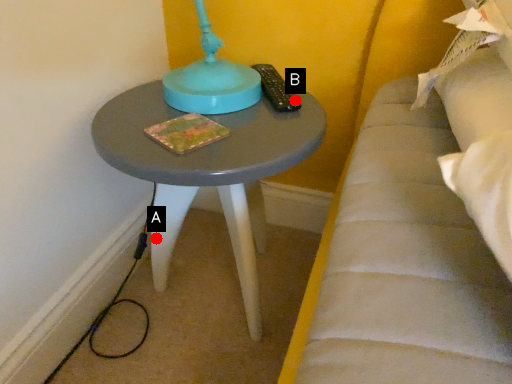
Question: Two points are circled on the image, labeled by A and B beside each circle. Which point appears closest to the camera in this image?

Choices:
 (A) A is closer
 (B) B is closer

Answer: (B)